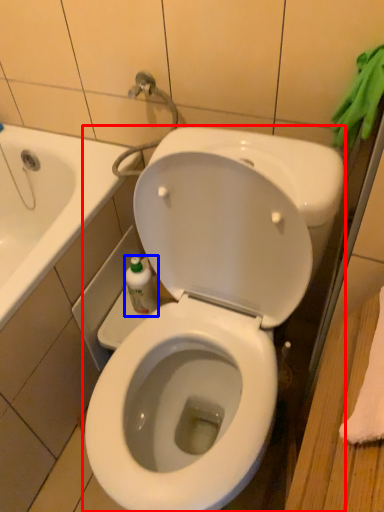
Question: Which point is closer to the camera, toilet (highlighted by a red box) or bottle (highlighted by a blue box)?

Choices:
 (A) toilet
 (B) bottle

Answer: (A)